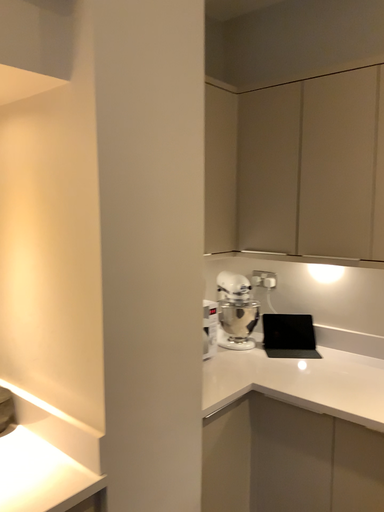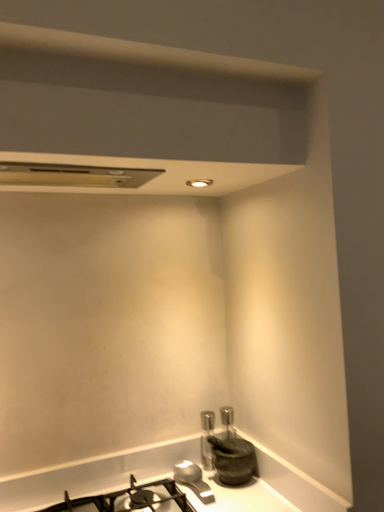
Question: How did the camera likely rotate when shooting the video?

Choices:
 (A) rotated right
 (B) rotated left

Answer: (B)